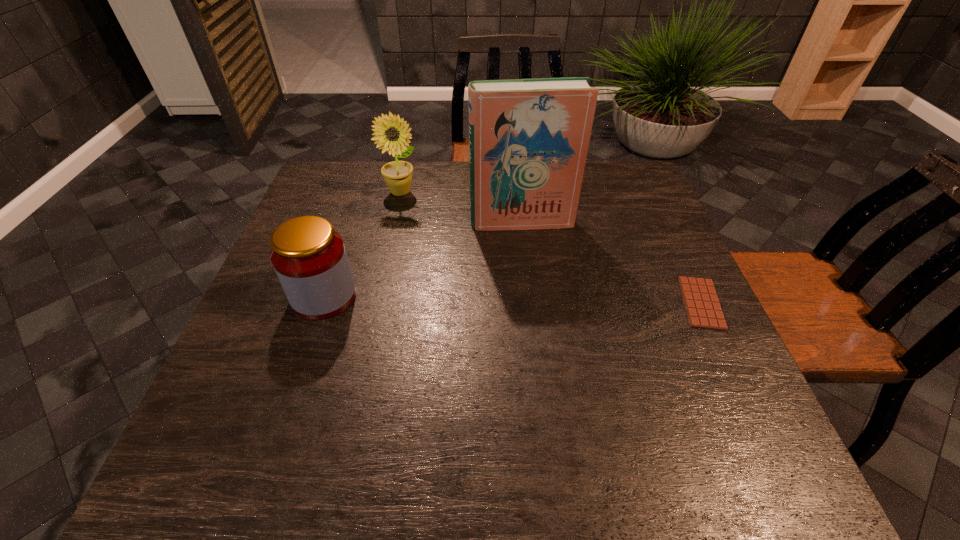
The image size is (960, 540). Identify the location of vacant space at the right edge of the desktop. (679, 267).

The image size is (960, 540). What are the coordinates of `free space at the far left corner` in the screenshot? It's located at (348, 162).

Where is `vacant region at the far right corner of the desktop`? The image size is (960, 540). vacant region at the far right corner of the desktop is located at coordinates (642, 178).

The height and width of the screenshot is (540, 960). Find the location of `empty space between the third tallest object and the sunflower`. empty space between the third tallest object and the sunflower is located at coordinates (363, 245).

At what (x,y) coordinates should I click in order to perform the action: click on blank region between the shortest object and the jar. Please return your answer as a coordinate pair (x, y). Looking at the image, I should click on pos(513,300).

Find the location of a particular element. free spot between the sunflower and the jar is located at coordinates (363, 245).

Identify the location of vacant space that's between the shortest object and the second shortest object. (513, 300).

This screenshot has height=540, width=960. I want to click on vacant area that lies between the jar and the candy bar, so click(x=513, y=300).

This screenshot has height=540, width=960. In order to click on free area in between the second shortest object and the candy bar in this screenshot , I will do `click(513, 300)`.

Where is `vacant space that is in between the jar and the second farthest object`? vacant space that is in between the jar and the second farthest object is located at coordinates (423, 259).